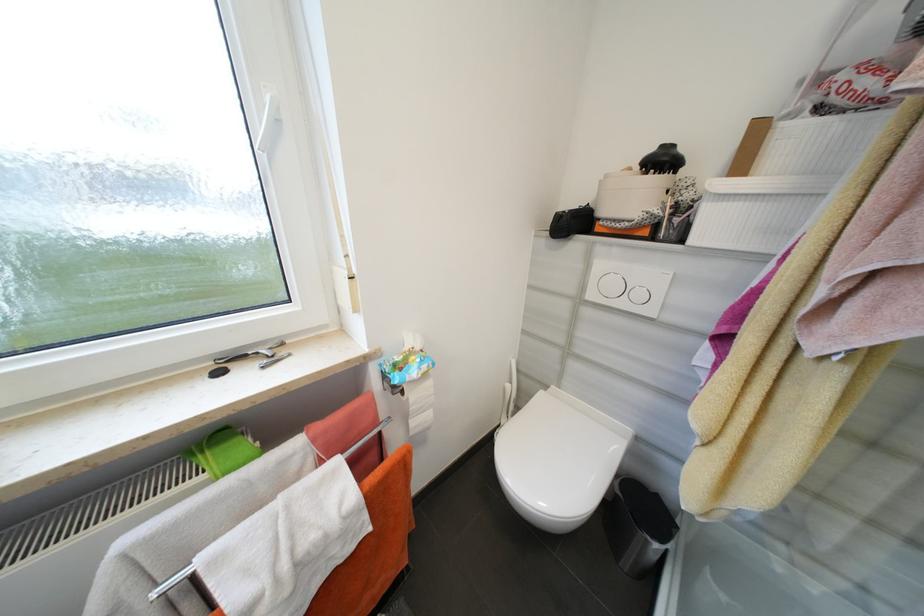
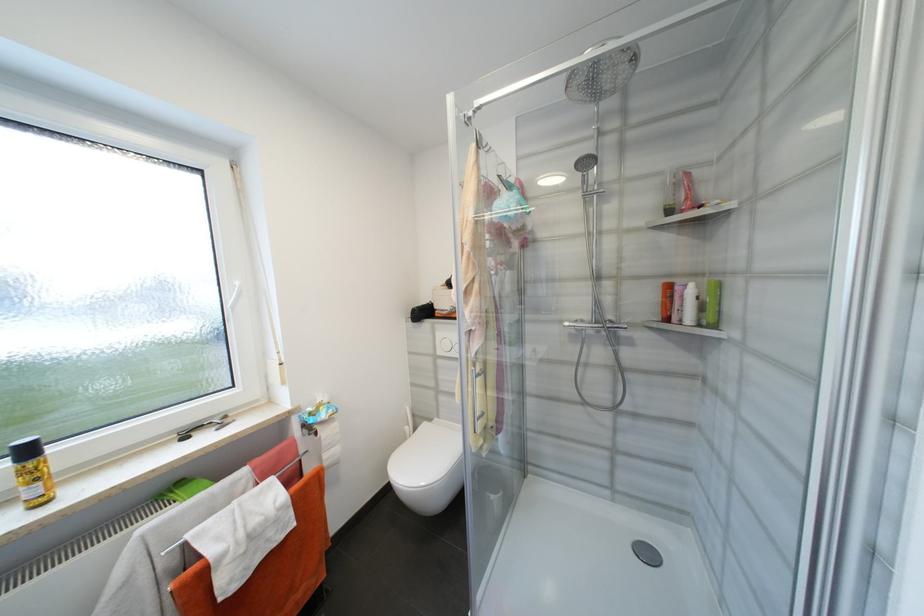
Find the pixel in the second image that matches (x=598, y=297) in the first image.

(445, 353)